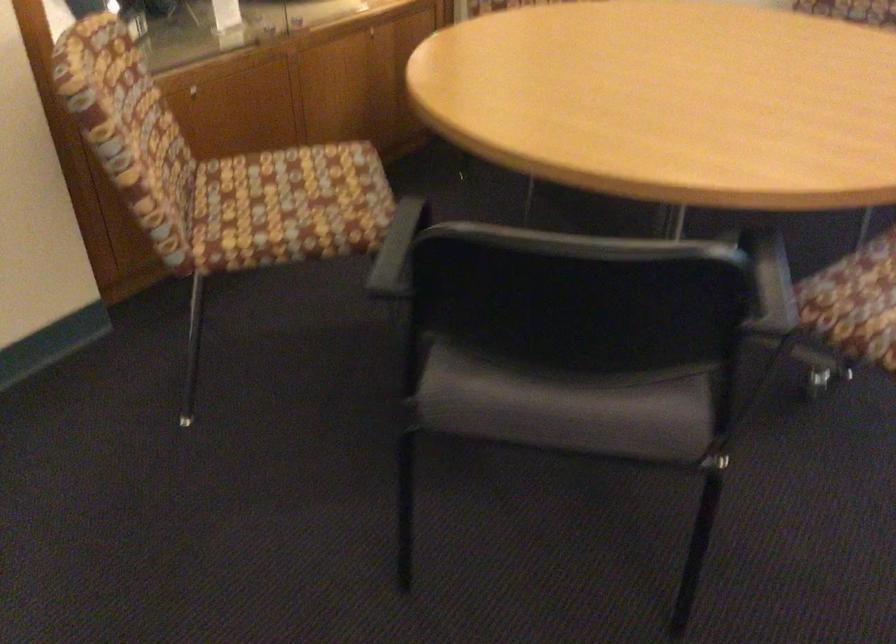
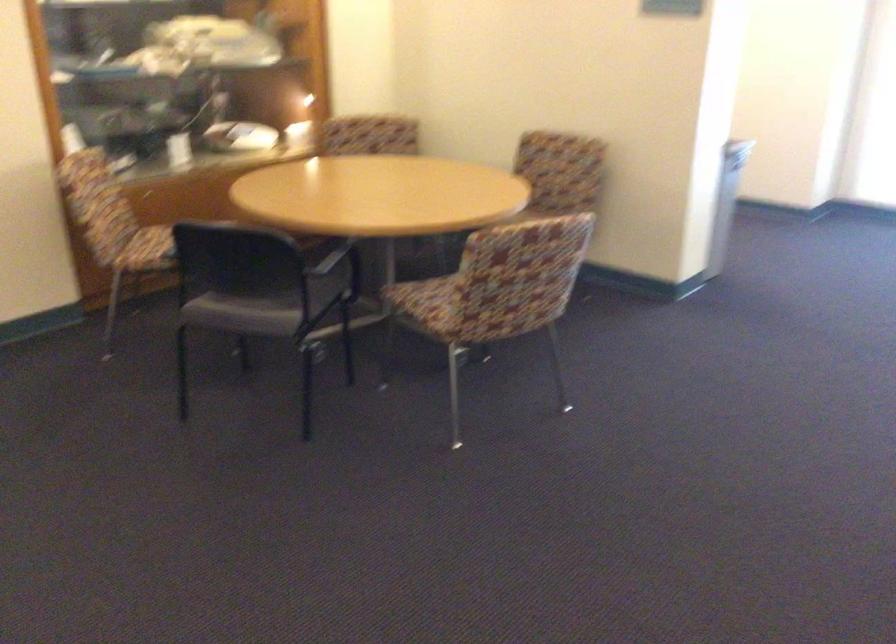
Which direction would the cameraman need to move to produce the second image?

The movement direction of the cameraman is right, backward.